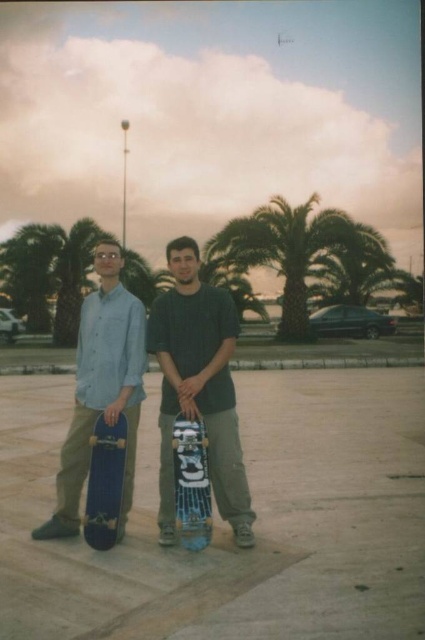
You are a photographer standing at the point marked as point [291,250]. Based on the scene description, which object in the image is directly behind you?

The point [291,250] is on the green leafy palm tree at center, so the green leafy palm tree at center is directly behind you.

You are a photographer standing at the camera position. You want to take a photo that includes both the green leafy palm tree at center and the two skateboarders. However, your camera has a maximum focus distance of 20 meters. Will the palm tree be in focus if you focus on the skateboarders?

The green leafy palm tree at center is 22.59 meters away from camera. If you focus on the skateboarders, who are closer than 20 meters, the palm tree will be out of focus because it exceeds the camera maximum focus distance of 20 meters.